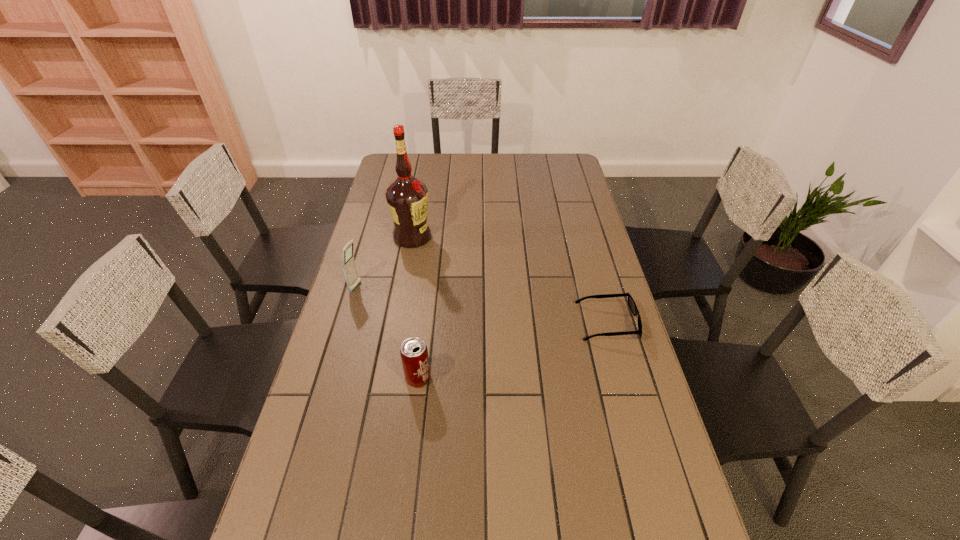
The width and height of the screenshot is (960, 540). I want to click on vacant area between the farthest object and the third nearest object, so click(x=384, y=262).

Locate an element on the screen. This screenshot has width=960, height=540. vacant space that is in between the leftmost object and the sunglasses is located at coordinates (x=482, y=305).

The width and height of the screenshot is (960, 540). In order to click on vacant area that lies between the second shortest object and the second nearest object in this screenshot , I will do `click(513, 351)`.

Where is `free space between the third farthest object and the second tallest object`? The width and height of the screenshot is (960, 540). free space between the third farthest object and the second tallest object is located at coordinates (482, 305).

Choose which object is the third nearest neighbor to the nearest object. Please provide its 2D coordinates. Your answer should be formatted as a tuple, i.e. [(x, y)], where the tuple contains the x and y coordinates of a point satisfying the conditions above.

[(407, 197)]

Select which object appears as the second closest to the third shortest object. Please provide its 2D coordinates. Your answer should be formatted as a tuple, i.e. [(x, y)], where the tuple contains the x and y coordinates of a point satisfying the conditions above.

[(414, 354)]

Image resolution: width=960 pixels, height=540 pixels. Find the location of `free spot that satisfies the following two spatial constraints: 1. on the front side of the second nearest object; 2. on the front-facing side of the alcohol`. free spot that satisfies the following two spatial constraints: 1. on the front side of the second nearest object; 2. on the front-facing side of the alcohol is located at coordinates (396, 323).

Image resolution: width=960 pixels, height=540 pixels. I want to click on free region that satisfies the following two spatial constraints: 1. on the front side of the alcohol; 2. on the front-facing side of the sunglasses, so click(396, 323).

You are a GUI agent. You are given a task and a screenshot of the screen. Output one action in this format:
    pyautogui.click(x=<x>, y=<y>)
    Task: Click on the free space that satisfies the following two spatial constraints: 1. on the back side of the second tallest object; 2. on the left side of the tallest object
    
    Given the screenshot: What is the action you would take?
    pos(371,237)

At what (x,y) coordinates should I click in order to perform the action: click on free location that satisfies the following two spatial constraints: 1. on the back side of the leftmost object; 2. on the left side of the farthest object. Please return your answer as a coordinate pair (x, y). Image resolution: width=960 pixels, height=540 pixels. Looking at the image, I should click on (371, 237).